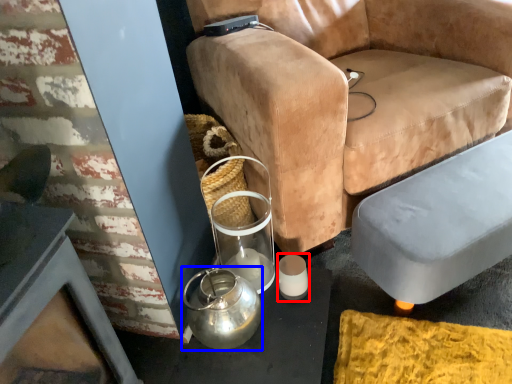
Question: Among these objects, which one is farthest to the camera, candle holder (highlighted by a red box) or tea pot (highlighted by a blue box)?

Choices:
 (A) candle holder
 (B) tea pot

Answer: (A)